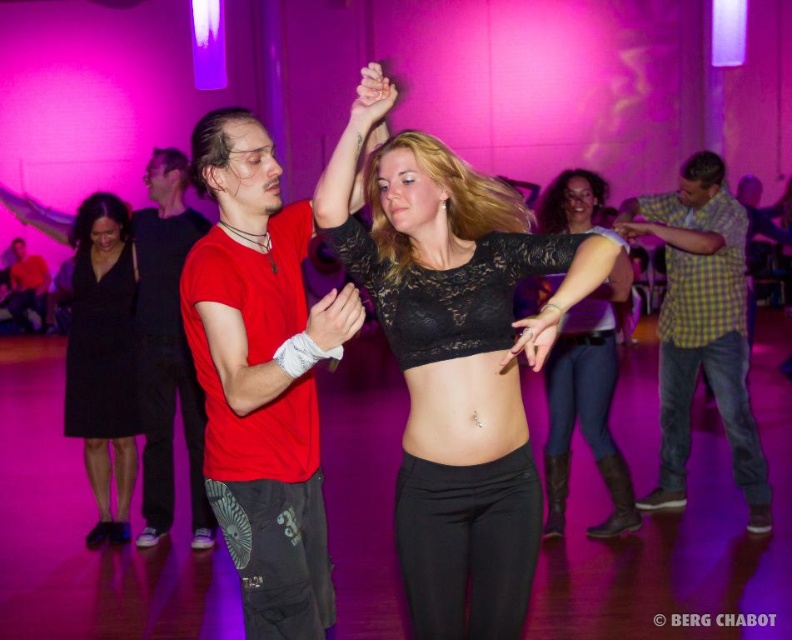
Who is shorter, black satin dress at lower left or red shirt at center?

black satin dress at lower left

Which is in front, point (78, 262) or point (155, 186)?

Point (155, 186) is in front.

Between point (89, 400) and point (154, 234), which one is positioned in front?

Point (154, 234) is in front.

This screenshot has width=792, height=640. I want to click on black satin dress at lower left, so click(x=103, y=358).

Between black lace top at center and matte black shirt at left, which one appears on the right side from the viewer's perspective?

black lace top at center is more to the right.

Is black lace top at center positioned in front of matte black shirt at left?

Yes, it is in front of matte black shirt at left.

Image resolution: width=792 pixels, height=640 pixels. What do you see at coordinates (587, 404) in the screenshot?
I see `black lace top at center` at bounding box center [587, 404].

Where is `black lace top at center`? This screenshot has height=640, width=792. black lace top at center is located at coordinates (587, 404).

Which is more to the right, matte red t-shirt at center or matte black shirt at left?

Positioned to the right is matte red t-shirt at center.

Who is more forward, (200,372) or (21,312)?

Positioned in front is point (200,372).

Locate an element on the screen. The image size is (792, 640). matte red t-shirt at center is located at coordinates (261, 376).